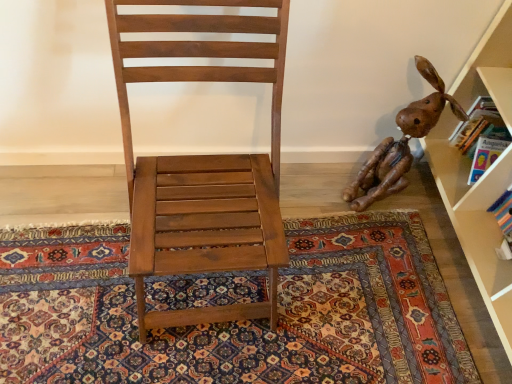
Where is `matte wood chair at center`? Image resolution: width=512 pixels, height=384 pixels. matte wood chair at center is located at coordinates (202, 164).

I want to click on carpeted floor at center, so click(236, 322).

The height and width of the screenshot is (384, 512). Describe the element at coordinates (401, 143) in the screenshot. I see `brown leather dog at right` at that location.

Identify the location of brown leather dog at right. This screenshot has height=384, width=512. (401, 143).

Find the location of a particular element. matte wood chair at center is located at coordinates (202, 164).

Could you tell me if brown leather dog at right is facing carpeted floor at center?

No, brown leather dog at right does not turn towards carpeted floor at center.

Between brown leather dog at right and carpeted floor at center, which one appears on the left side from the viewer's perspective?

carpeted floor at center is more to the left.

Is there a large distance between brown leather dog at right and carpeted floor at center?

They are positioned close to each other.

From the image's perspective, which one is positioned higher, matte wood chair at center or brown leather dog at right?

brown leather dog at right appears higher in the image.

Is matte wood chair at center spatially inside brown leather dog at right, or outside of it?

matte wood chair at center lies outside brown leather dog at right.

Between matte wood chair at center and brown leather dog at right, which one appears on the right side from the viewer's perspective?

Positioned to the right is brown leather dog at right.

From a real-world perspective, relative to brown leather dog at right, is matte wood chair at center vertically above or below?

Clearly, from a real-world perspective, matte wood chair at center is above brown leather dog at right.

Considering the sizes of carpeted floor at center and brown leather dog at right in the image, is carpeted floor at center wider or thinner than brown leather dog at right?

Considering their sizes, carpeted floor at center looks broader than brown leather dog at right.

Considering the sizes of carpeted floor at center and brown leather dog at right in the image, is carpeted floor at center taller or shorter than brown leather dog at right?

carpeted floor at center is shorter than brown leather dog at right.

Considering the positions of objects carpeted floor at center and brown leather dog at right in the image provided, who is behind, carpeted floor at center or brown leather dog at right?

brown leather dog at right.

From the image's perspective, is brown leather dog at right below matte wood chair at center?

No.

Considering the positions of objects brown leather dog at right and matte wood chair at center in the image provided, who is in front, brown leather dog at right or matte wood chair at center?

Positioned in front is matte wood chair at center.

Measure the distance between brown leather dog at right and matte wood chair at center.

They are 25.24 inches apart.

The width and height of the screenshot is (512, 384). I want to click on chair lying on the left of carpeted floor at center, so click(x=202, y=164).

Consider the image. Is there a large distance between carpeted floor at center and matte wood chair at center?

That's not correct — carpeted floor at center is a little close to matte wood chair at center.

Who is bigger, carpeted floor at center or matte wood chair at center?

matte wood chair at center is bigger.

Which of these two, carpeted floor at center or matte wood chair at center, is thinner?

With smaller width is matte wood chair at center.

Is matte wood chair at center looking in the opposite direction of carpeted floor at center?

That's not correct — matte wood chair at center is not looking away from carpeted floor at center.

Who is taller, matte wood chair at center or carpeted floor at center?

matte wood chair at center is taller.

Are matte wood chair at center and carpeted floor at center located far from each other?

Actually, matte wood chair at center and carpeted floor at center are a little close together.

From a real-world perspective, does matte wood chair at center sit lower than carpeted floor at center?

Incorrect, from a real-world perspective, matte wood chair at center is higher than carpeted floor at center.

Identify the location of toy above the carpeted floor at center (from a real-world perspective). (401, 143).

Find the location of `chair that appears on the left of brown leather dog at right`. chair that appears on the left of brown leather dog at right is located at coordinates (202, 164).

Which object lies further to the anchor point matte wood chair at center, brown leather dog at right or carpeted floor at center?

Among the two, brown leather dog at right is located further to matte wood chair at center.

From the image, which object appears to be nearer to matte wood chair at center, carpeted floor at center or brown leather dog at right?

carpeted floor at center.

Considering their positions, is carpeted floor at center positioned further to brown leather dog at right than matte wood chair at center?

matte wood chair at center is further to brown leather dog at right.

Looking at the image, which one is located further to brown leather dog at right, matte wood chair at center or carpeted floor at center?

matte wood chair at center lies further to brown leather dog at right than the other object.

In the scene shown: From the image, which object appears to be nearer to carpeted floor at center, brown leather dog at right or matte wood chair at center?

brown leather dog at right lies closer to carpeted floor at center than the other object.

When comparing their distances from carpeted floor at center, does matte wood chair at center or brown leather dog at right seem further?

matte wood chair at center is positioned further to the anchor carpeted floor at center.

At what (x,y) coordinates should I click in order to perform the action: click on mat between matte wood chair at center and brown leather dog at right. Please return your answer as a coordinate pair (x, y). This screenshot has width=512, height=384. Looking at the image, I should click on (236, 322).